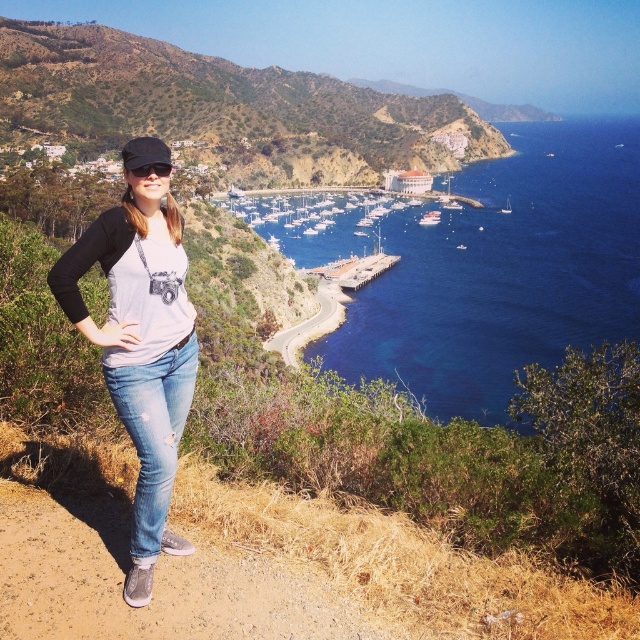
Question: Which point is farther to the camera?

Choices:
 (A) (371, 300)
 (B) (115, 378)
 (C) (140, 173)

Answer: (A)

Question: Which object is farther from the camera taking this photo?

Choices:
 (A) denim jeans at center
 (B) green grassy hillside at upper left
 (C) blue water at center

Answer: (B)

Question: Is green grassy hillside at upper left above black fabric baseball cap at upper left?

Choices:
 (A) no
 (B) yes

Answer: (B)

Question: From the image, what is the correct spatial relationship of light blue denim jeans at lower left in relation to black matte goggles at upper center?

Choices:
 (A) below
 (B) above

Answer: (A)

Question: Is green grassy hillside at upper left positioned at the back of light blue denim jeans at lower left?

Choices:
 (A) yes
 (B) no

Answer: (A)

Question: Estimate the real-world distances between objects in this image. Which object is closer to the smooth asphalt road at center?

Choices:
 (A) denim jeans at center
 (B) black matte goggles at upper center
 (C) light blue denim jeans at lower left

Answer: (A)